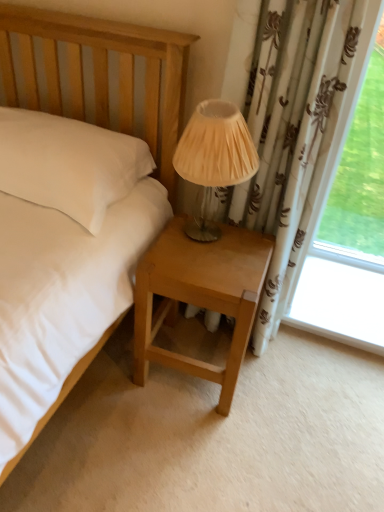
Image resolution: width=384 pixels, height=512 pixels. In order to click on matte beige fabric lampshade at center in this screenshot , I will do [213, 160].

Based on the photo, measure the distance between matte beige fabric lampshade at center and camera.

matte beige fabric lampshade at center is 3.65 feet away from camera.

Describe the element at coordinates (213, 160) in the screenshot. I see `matte beige fabric lampshade at center` at that location.

What is the approximate height of light brown wood nightstand at lower center?

The height of light brown wood nightstand at lower center is 21.67 inches.

This screenshot has width=384, height=512. What do you see at coordinates (199, 296) in the screenshot?
I see `light brown wood nightstand at lower center` at bounding box center [199, 296].

The width and height of the screenshot is (384, 512). I want to click on light brown wood nightstand at lower center, so click(199, 296).

Find the location of a particular element. matte beige fabric lampshade at center is located at coordinates (213, 160).

Is matte beige fabric lampshade at center to the right of light brown wood nightstand at lower center from the viewer's perspective?

Indeed, matte beige fabric lampshade at center is positioned on the right side of light brown wood nightstand at lower center.

Is matte beige fabric lampshade at center closer to camera compared to light brown wood nightstand at lower center?

Yes.

Which is less distant, (202, 149) or (158, 257)?

The point (202, 149) is more forward.

From the image's perspective, is matte beige fabric lampshade at center located above or below light brown wood nightstand at lower center?

Based on their image positions, matte beige fabric lampshade at center is located above light brown wood nightstand at lower center.

From a real-world perspective, does matte beige fabric lampshade at center stand above light brown wood nightstand at lower center?

Yes.

Looking at their sizes, would you say matte beige fabric lampshade at center is wider or thinner than light brown wood nightstand at lower center?

Clearly, matte beige fabric lampshade at center has less width compared to light brown wood nightstand at lower center.

Does matte beige fabric lampshade at center have a greater height compared to light brown wood nightstand at lower center?

No, matte beige fabric lampshade at center is not taller than light brown wood nightstand at lower center.

Between matte beige fabric lampshade at center and light brown wood nightstand at lower center, which one has smaller size?

matte beige fabric lampshade at center is smaller.

Would you say matte beige fabric lampshade at center is outside light brown wood nightstand at lower center?

Indeed, matte beige fabric lampshade at center is completely outside light brown wood nightstand at lower center.

Are matte beige fabric lampshade at center and light brown wood nightstand at lower center making contact?

A: No, matte beige fabric lampshade at center is not with light brown wood nightstand at lower center.

Does matte beige fabric lampshade at center turn towards light brown wood nightstand at lower center?

No, matte beige fabric lampshade at center is not aimed at light brown wood nightstand at lower center.

How many degrees apart are the facing directions of matte beige fabric lampshade at center and light brown wood nightstand at lower center?

The facing directions of matte beige fabric lampshade at center and light brown wood nightstand at lower center are 2.49 degrees apart.

Measure the distance from matte beige fabric lampshade at center to light brown wood nightstand at lower center.

9.80 inches.

This screenshot has width=384, height=512. Find the location of `nightstand on the left of matte beige fabric lampshade at center`. nightstand on the left of matte beige fabric lampshade at center is located at coordinates (199, 296).

Does light brown wood nightstand at lower center appear on the left side of matte beige fabric lampshade at center?

Yes, light brown wood nightstand at lower center is to the left of matte beige fabric lampshade at center.

Between light brown wood nightstand at lower center and matte beige fabric lampshade at center, which one is positioned in front?

matte beige fabric lampshade at center is more forward.

Between point (249, 300) and point (204, 196), which one is positioned in front?

The point (249, 300) is more forward.

Based on the photo, from the image's perspective, is light brown wood nightstand at lower center over matte beige fabric lampshade at center?

Actually, light brown wood nightstand at lower center appears below matte beige fabric lampshade at center in the image.

From a real-world perspective, is light brown wood nightstand at lower center positioned above or below matte beige fabric lampshade at center?

light brown wood nightstand at lower center is situated lower than matte beige fabric lampshade at center in the real world.

Can you confirm if light brown wood nightstand at lower center is wider than matte beige fabric lampshade at center?

Correct, the width of light brown wood nightstand at lower center exceeds that of matte beige fabric lampshade at center.

Consider the image. Is light brown wood nightstand at lower center shorter than matte beige fabric lampshade at center?

No.

Considering the sizes of light brown wood nightstand at lower center and matte beige fabric lampshade at center in the image, is light brown wood nightstand at lower center bigger or smaller than matte beige fabric lampshade at center?

light brown wood nightstand at lower center is bigger than matte beige fabric lampshade at center.

Can matte beige fabric lampshade at center be found inside light brown wood nightstand at lower center?

No, matte beige fabric lampshade at center is not surrounded by light brown wood nightstand at lower center.

Would you say light brown wood nightstand at lower center is a long distance from matte beige fabric lampshade at center?

No.

Is light brown wood nightstand at lower center looking in the opposite direction of matte beige fabric lampshade at center?

light brown wood nightstand at lower center is not turned away from matte beige fabric lampshade at center.

Based on the photo, what's the angular difference between light brown wood nightstand at lower center and matte beige fabric lampshade at center's facing directions?

The angular difference between light brown wood nightstand at lower center and matte beige fabric lampshade at center is 2.49 degrees.

How far apart are light brown wood nightstand at lower center and matte beige fabric lampshade at center?

9.80 inches.

The image size is (384, 512). I want to click on nightstand below the matte beige fabric lampshade at center (from the image's perspective), so click(x=199, y=296).

Identify the location of table lamp that is above the light brown wood nightstand at lower center (from the image's perspective). This screenshot has height=512, width=384. (213, 160).

Where is `table lamp to the right of light brown wood nightstand at lower center`? The width and height of the screenshot is (384, 512). table lamp to the right of light brown wood nightstand at lower center is located at coordinates (213, 160).